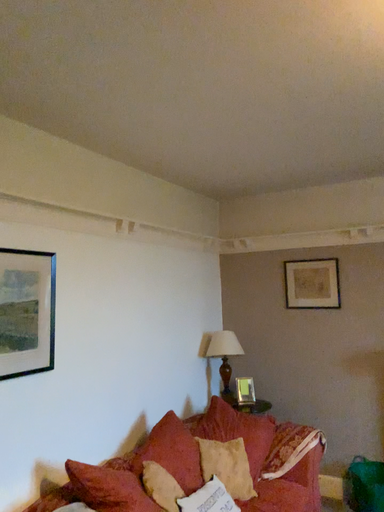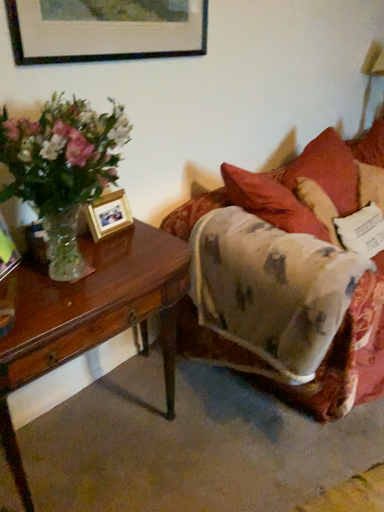
Question: How did the camera likely rotate when shooting the video?

Choices:
 (A) rotated right
 (B) rotated left

Answer: (B)